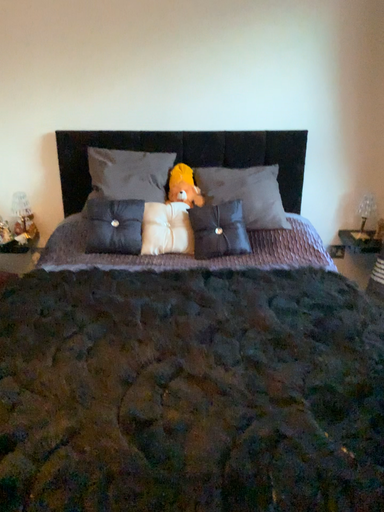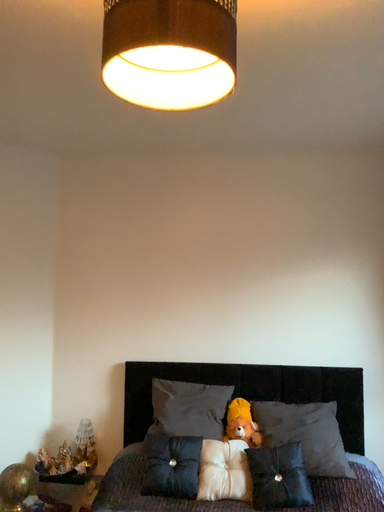
Question: Which way did the camera rotate in the video?

Choices:
 (A) rotated left
 (B) rotated right

Answer: (A)